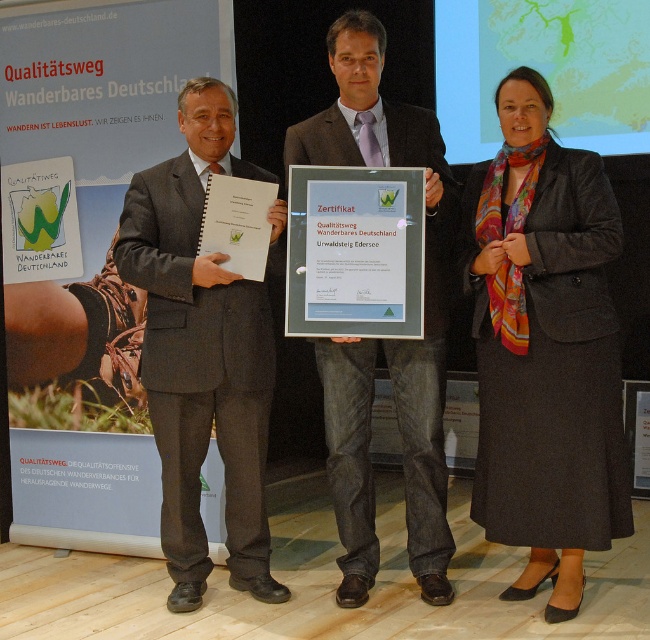
Question: Which point is closer to the camera taking this photo?

Choices:
 (A) (185, 396)
 (B) (302, 330)

Answer: (B)

Question: Is dark gray wool skirt at lower right bigger than matte black suit at center?

Choices:
 (A) no
 (B) yes

Answer: (B)

Question: Estimate the real-world distances between objects in this image. Which object is farther from the green glass certificate at center?

Choices:
 (A) dark gray suit at center
 (B) matte black suit at center
 (C) dark gray wool skirt at lower right

Answer: (C)

Question: Is dark gray wool skirt at lower right further to the viewer compared to green glass certificate at center?

Choices:
 (A) yes
 (B) no

Answer: (B)

Question: From the image, what is the correct spatial relationship of dark gray suit at center in relation to green glass certificate at center?

Choices:
 (A) below
 (B) above

Answer: (A)

Question: Which of the following is the farthest from the observer?

Choices:
 (A) (406, 332)
 (B) (278, 216)

Answer: (B)